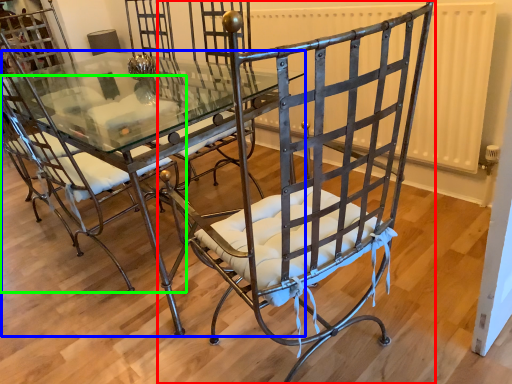
Question: Based on their relative distances, which object is nearer to chair (highlighted by a red box)? Choose from table (highlighted by a blue box) and chair (highlighted by a green box).

Choices:
 (A) table
 (B) chair

Answer: (B)